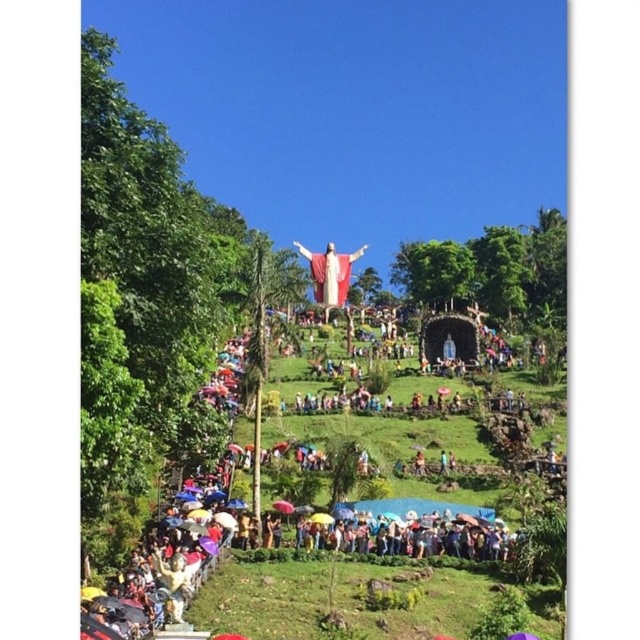
Question: Can you confirm if multicolored umbrellas at center is positioned to the right of polychrome statue at center?

Choices:
 (A) no
 (B) yes

Answer: (B)

Question: Is multicolored umbrellas at center to the right of polychrome statue at center from the viewer's perspective?

Choices:
 (A) no
 (B) yes

Answer: (B)

Question: Does multicolored umbrellas at center appear on the left side of polychrome statue at center?

Choices:
 (A) no
 (B) yes

Answer: (A)

Question: Which point is farther from the camera taking this photo?

Choices:
 (A) (346, 253)
 (B) (499, 563)

Answer: (A)